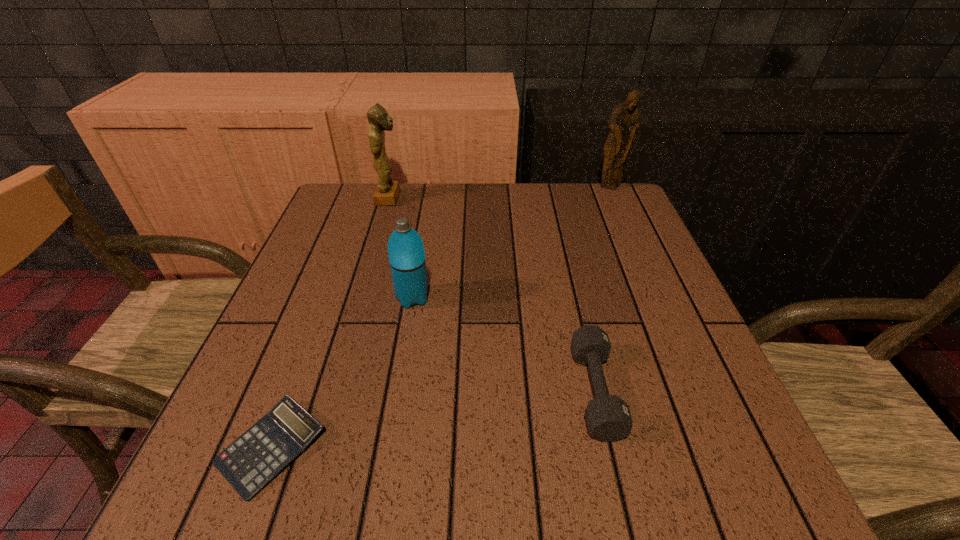
In order to click on free space between the rightmost object and the second object from right to left in this screenshot , I will do `click(603, 289)`.

What are the coordinates of `empty space between the third tallest object and the fourth object from left to right` in the screenshot? It's located at (504, 344).

The width and height of the screenshot is (960, 540). Find the location of `free area in between the right figurine and the fourth object from left to right`. free area in between the right figurine and the fourth object from left to right is located at coordinates (603, 289).

At what (x,y) coordinates should I click in order to perform the action: click on vacant space in between the fourth object from left to right and the shortest object. Please return your answer as a coordinate pair (x, y). Image resolution: width=960 pixels, height=540 pixels. Looking at the image, I should click on (434, 419).

Choose which object is the nearest neighbor to the rightmost object. Please provide its 2D coordinates. Your answer should be formatted as a tuple, i.e. [(x, y)], where the tuple contains the x and y coordinates of a point satisfying the conditions above.

[(387, 191)]

Identify which object is the second nearest to the third farthest object. Please provide its 2D coordinates. Your answer should be formatted as a tuple, i.e. [(x, y)], where the tuple contains the x and y coordinates of a point satisfying the conditions above.

[(608, 417)]

Find the location of a particular element. vacant space that satisfies the following two spatial constraints: 1. on the back side of the calculator; 2. on the right side of the dumbbell is located at coordinates (293, 390).

Image resolution: width=960 pixels, height=540 pixels. In order to click on vacant area that satisfies the following two spatial constraints: 1. on the front-facing side of the dumbbell; 2. on the left side of the left figurine in this screenshot , I will do `click(333, 390)`.

Where is `vacant space that satisfies the following two spatial constraints: 1. on the front-facing side of the rightmost object; 2. on the front-facing side of the left figurine`? vacant space that satisfies the following two spatial constraints: 1. on the front-facing side of the rightmost object; 2. on the front-facing side of the left figurine is located at coordinates (614, 198).